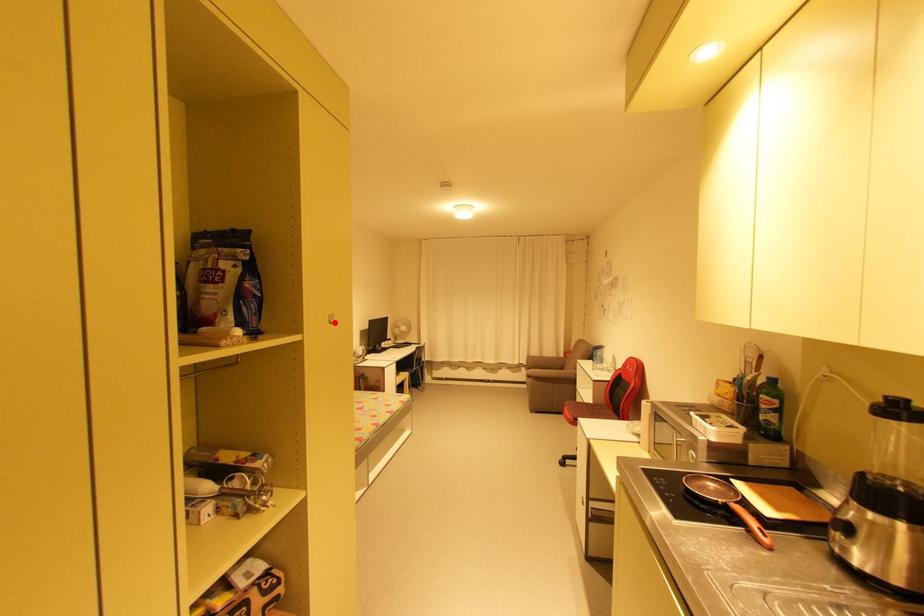
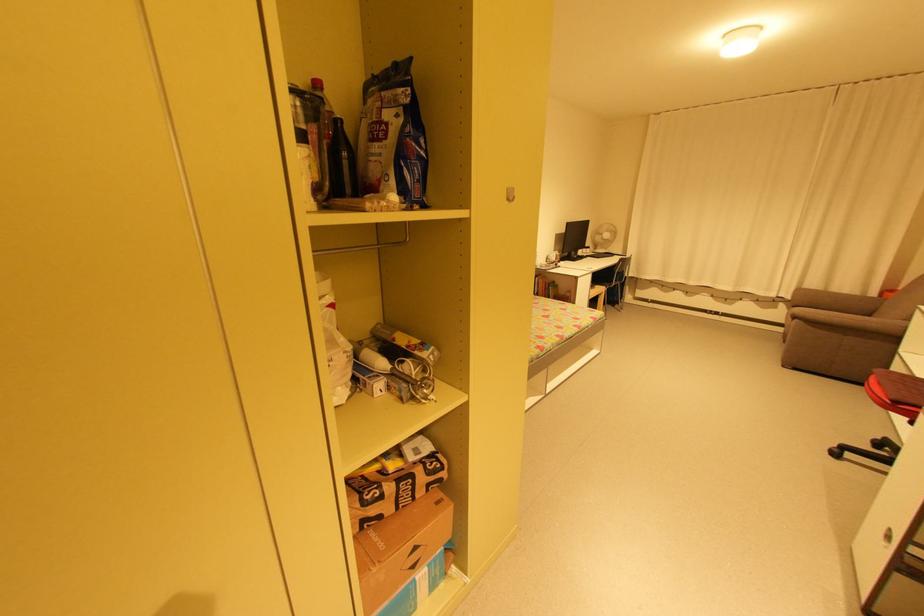
Find the pixel in the second image that matches the highlighted location in the first image.

(513, 200)